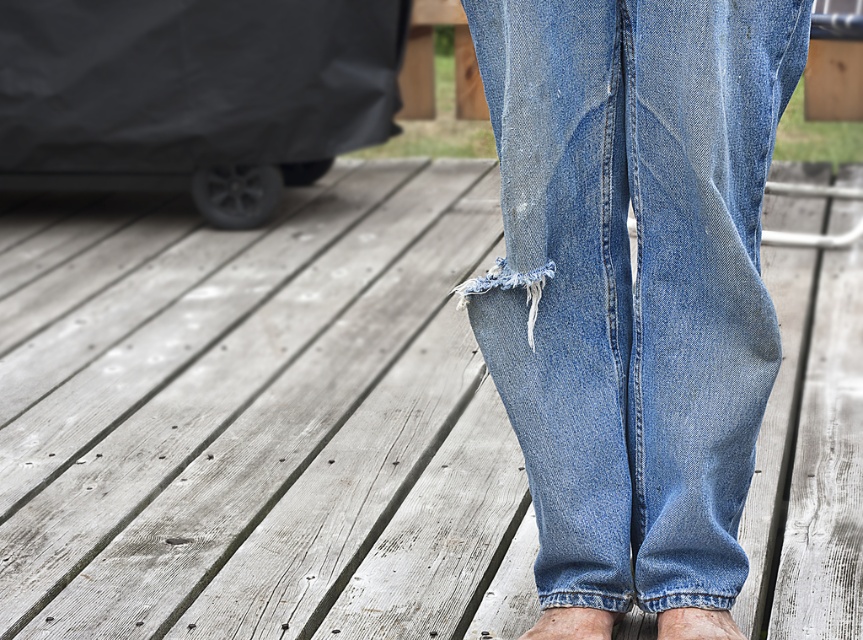
You are a photographer adjusting your camera to focus on the blue denim foot at lower center and the light brown skin at lower center. Which object should you focus on first to ensure it appears sharp in the photo?

The blue denim foot at lower center is further to the viewer than the light brown skin at lower center, so you should focus on the blue denim foot at lower center first to ensure it appears sharp.

You are a photographer adjusting your camera focus. You notice the denim at center and the light brown skin at lower center in your frame. Which object should you focus on first if you want to ensure the closest subject is sharp?

The denim at center is closer to the viewer than the light brown skin at lower center, so you should focus on the denim at center first to ensure the closest subject is sharp.